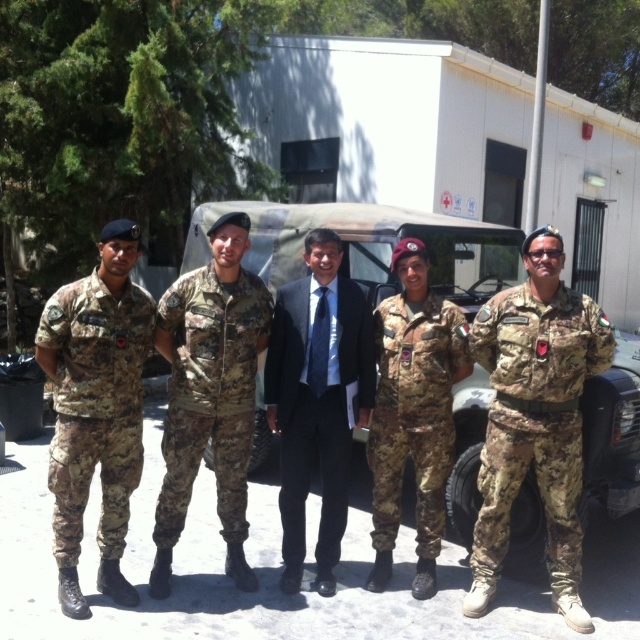
You are a photographer at a military base and need to capture a photo where the dark blue suit at center and the camouflage fabric uniform at center are clearly visible. Since the camera has a limited depth of field, which subject should you focus on to ensure the taller one is in sharp focus?

The dark blue suit at center is taller than the camouflage fabric uniform at center, so you should focus on the dark blue suit at center to ensure it is in sharp focus.

You are a photographer trying to capture a group photo of the soldiers and the civilian. You need to ensure that the person wearing the camouflage fabric uniform at right is positioned exactly at point (x=536, y=419). Where should you place this individual in the frame?

The camouflage fabric uniform at right should be placed exactly at point (x=536, y=419) in the frame to meet the requirement.

You are a photographer trying to capture a clear photo of the dark blue suit at center and the camo fabric uniform at center. Since you want to focus on the civilian, which of the two subjects should you adjust your camera settings to prioritize in terms of size?

The dark blue suit at center is larger in size than the camo fabric uniform at center, so you should prioritize focusing on the dark blue suit at center as it is the civilian.